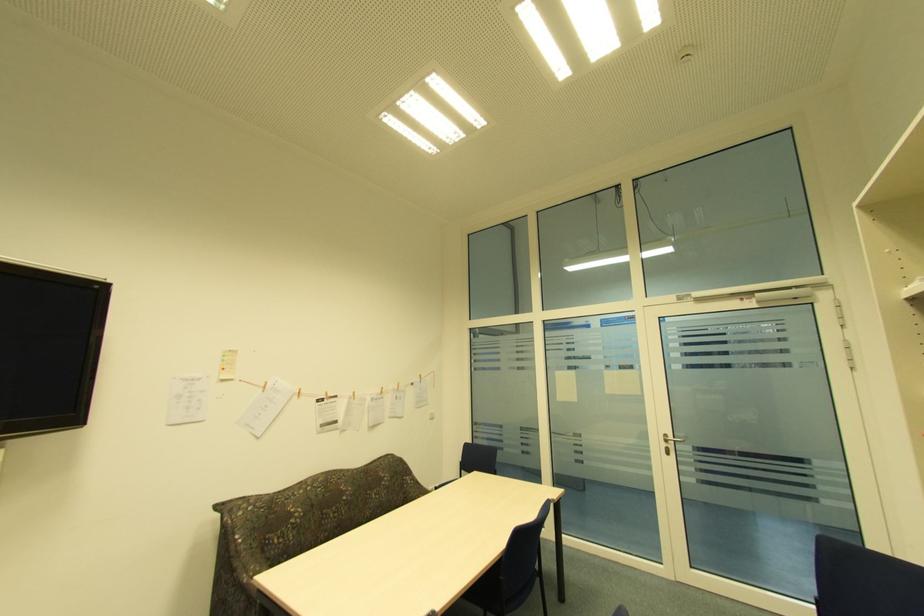
Where is `silver door handle`? This screenshot has width=924, height=616. silver door handle is located at coordinates (671, 439).